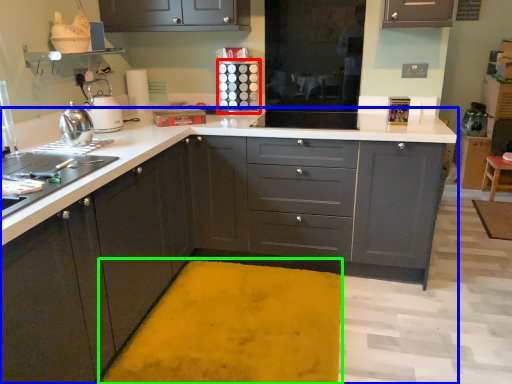
Question: Which object is positioned farthest from appliance (highlighted by a red box)? Select from countertop (highlighted by a blue box) and bath mat (highlighted by a green box).

Choices:
 (A) countertop
 (B) bath mat

Answer: (B)